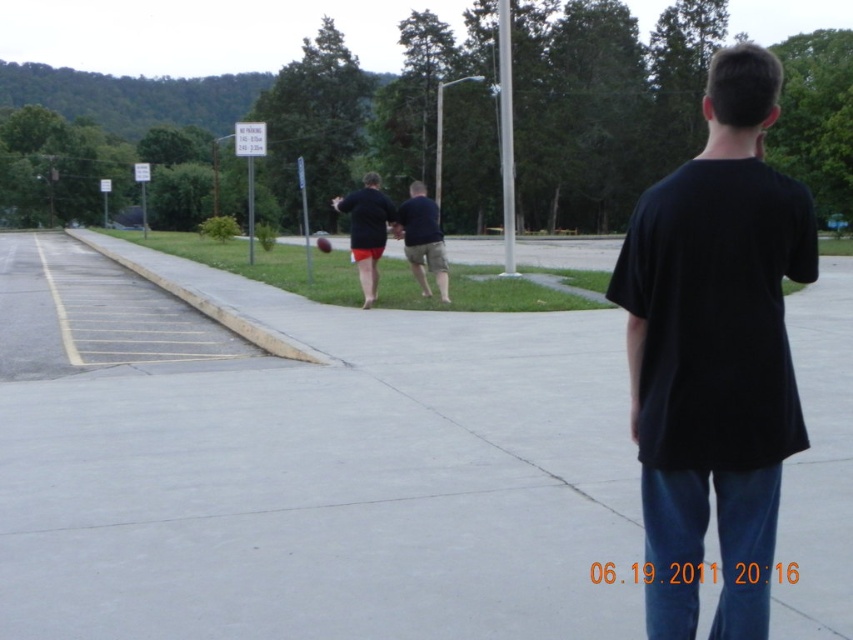
Question: Is black cotton shirt at center positioned at the back of matte black shirt at center?

Choices:
 (A) yes
 (B) no

Answer: (B)

Question: Does gray concrete pavement at center appear on the right side of matte black shirt at center?

Choices:
 (A) no
 (B) yes

Answer: (B)

Question: Which object is positioned farthest from the black cotton shirt at center?

Choices:
 (A) matte black shirt at center
 (B) gray concrete pavement at center

Answer: (A)

Question: Among these objects, which one is farthest from the camera?

Choices:
 (A) black cotton shirt at center
 (B) dark blue shirt at center

Answer: (B)

Question: Is gray concrete pavement at center bigger than matte black shirt at center?

Choices:
 (A) no
 (B) yes

Answer: (A)

Question: Based on their relative distances, which object is farther from the matte black shirt at center?

Choices:
 (A) black cotton shirt at center
 (B) dark blue shirt at center

Answer: (A)